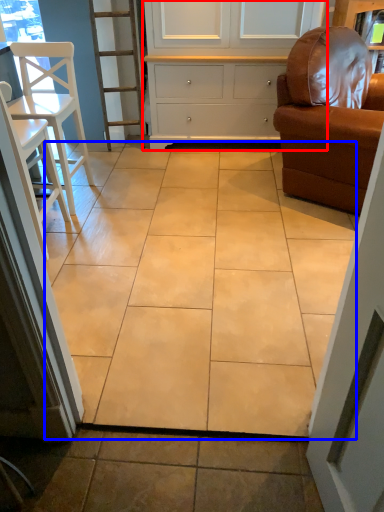
Question: Among these objects, which one is nearest to the camera, cabinetry (highlighted by a red box) or ceramic tile (highlighted by a blue box)?

Choices:
 (A) cabinetry
 (B) ceramic tile

Answer: (B)